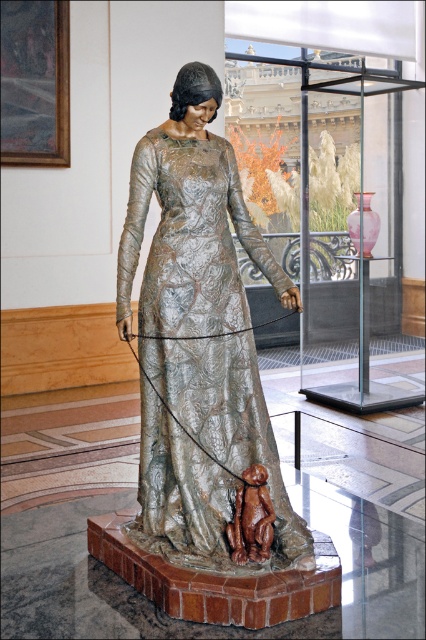
Question: Considering the relative positions of shiny silver dress at center and brown clay monkey at lower center in the image provided, where is shiny silver dress at center located with respect to brown clay monkey at lower center?

Choices:
 (A) left
 (B) right

Answer: (A)

Question: Is shiny silver dress at center closer to camera compared to brown clay monkey at lower center?

Choices:
 (A) yes
 (B) no

Answer: (B)

Question: Among these points, which one is nearest to the camera?

Choices:
 (A) (213, 532)
 (B) (255, 529)

Answer: (B)

Question: Can you confirm if shiny silver dress at center is wider than brown clay monkey at lower center?

Choices:
 (A) no
 (B) yes

Answer: (B)

Question: Which object appears closest to the camera in this image?

Choices:
 (A) brown clay monkey at lower center
 (B) shiny silver dress at center

Answer: (A)